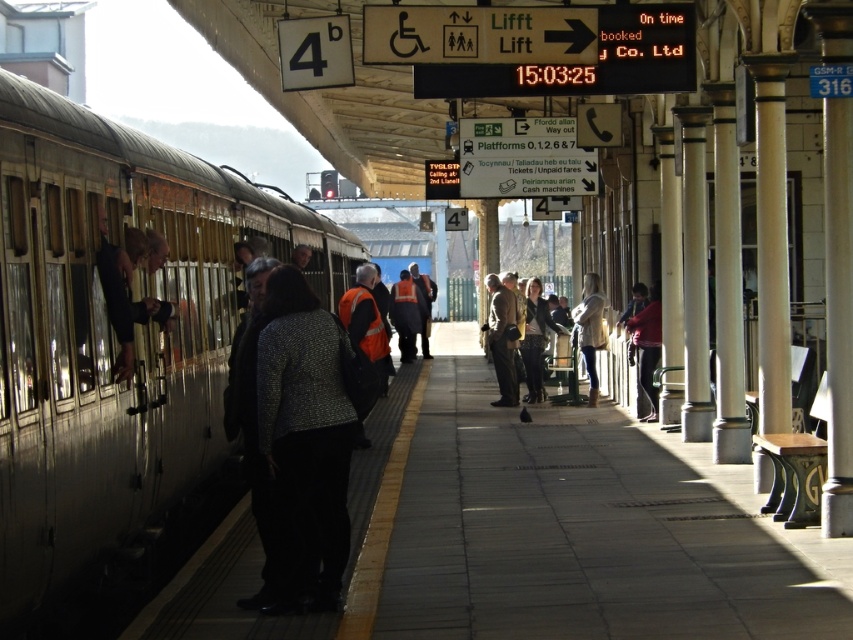
Image resolution: width=853 pixels, height=640 pixels. What do you see at coordinates (115, 332) in the screenshot?
I see `silver metallic train at left` at bounding box center [115, 332].

Between point (338, 262) and point (511, 336), which one is positioned in front?

Point (511, 336) is more forward.

I want to click on silver metallic train at left, so click(115, 332).